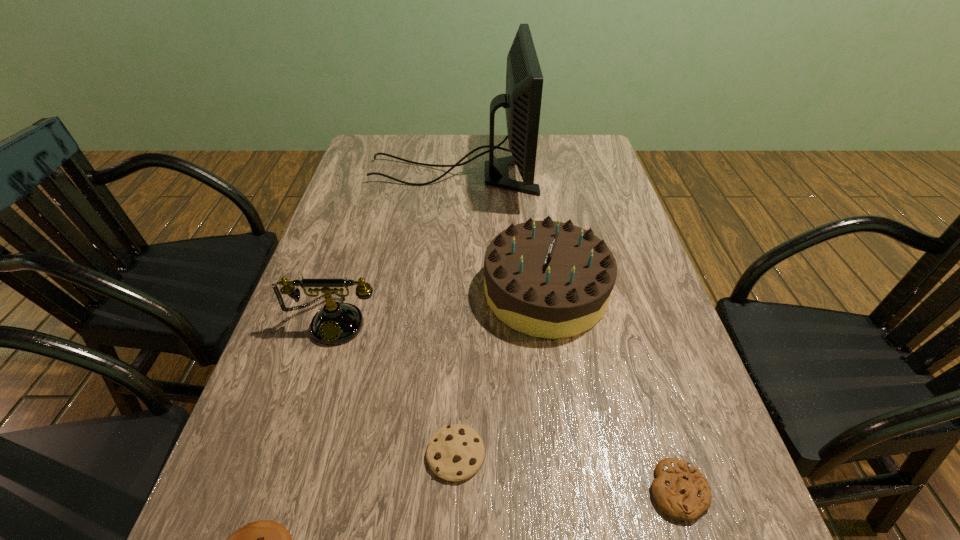
Locate an element on the screen. object located at the far left corner is located at coordinates (524, 81).

Where is `free space at the far edge`? free space at the far edge is located at coordinates (468, 150).

Where is `vacant space at the left edge`? The width and height of the screenshot is (960, 540). vacant space at the left edge is located at coordinates (370, 284).

Locate an element on the screen. The width and height of the screenshot is (960, 540). free location at the right edge is located at coordinates (574, 189).

Identify the location of vacant space at the far right corner. The width and height of the screenshot is (960, 540). pos(564,168).

Where is `free space between the telephone and the tallest object`? This screenshot has width=960, height=540. free space between the telephone and the tallest object is located at coordinates (395, 247).

Find the location of a particular element. Image resolution: width=960 pixels, height=540 pixels. vacant area that lies between the second cookie from right to left and the second shortest cookie is located at coordinates coord(567,472).

The height and width of the screenshot is (540, 960). I want to click on free space between the tallest object and the birthday cake, so click(499, 233).

Where is `vacant space that is in between the birthday cake and the farthest object`? This screenshot has height=540, width=960. vacant space that is in between the birthday cake and the farthest object is located at coordinates (499, 233).

Find the location of a particular element. vacant space that's between the rightmost cookie and the birthday cake is located at coordinates (612, 391).